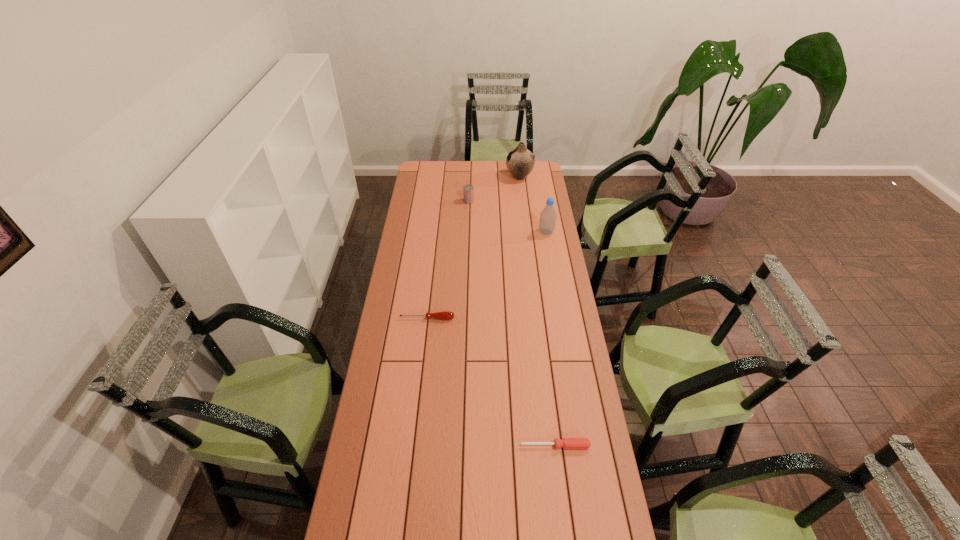
I want to click on free region located 0.050m from the spout of the pottery, so click(x=497, y=177).

Identify the location of vacant region located 0.340m on the front of the bottle. Image resolution: width=960 pixels, height=540 pixels. (555, 284).

At what (x,y) coordinates should I click in order to perform the action: click on vacant space situated on the front of the third tallest object. Please return your answer as a coordinate pair (x, y). This screenshot has height=540, width=960. Looking at the image, I should click on (468, 209).

Where is `free space located on the back of the leftmost object`? free space located on the back of the leftmost object is located at coordinates (430, 288).

In order to click on vacant space located on the front of the right screwdriver in this screenshot , I will do `click(564, 516)`.

Identify the location of object that is positioned at the far edge. (520, 161).

The image size is (960, 540). What are the coordinates of `object that is at the left edge` in the screenshot? It's located at (444, 315).

The height and width of the screenshot is (540, 960). I want to click on pottery at the right edge, so click(x=520, y=161).

Identify the location of bottle that is at the right edge. (548, 216).

Where is `screwdriver present at the right edge`? This screenshot has width=960, height=540. screwdriver present at the right edge is located at coordinates [x=567, y=443].